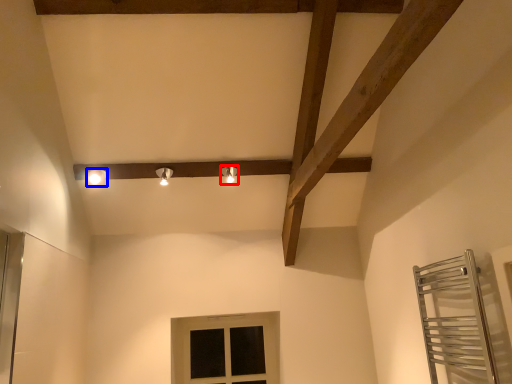
Question: Among these objects, which one is nearest to the camera, light fixture (highlighted by a red box) or light fixture (highlighted by a blue box)?

Choices:
 (A) light fixture
 (B) light fixture

Answer: (B)